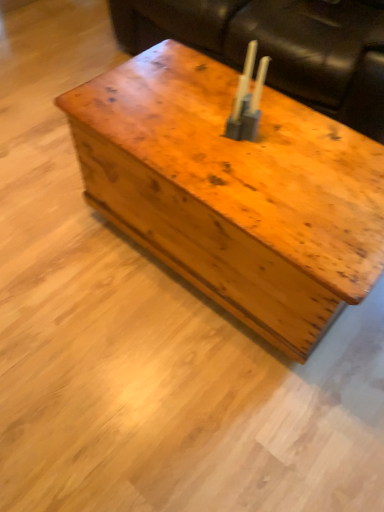
Question: Considering the relative sizes of metallic silver candle holder at center and leather couch at upper center in the image provided, is metallic silver candle holder at center shorter than leather couch at upper center?

Choices:
 (A) yes
 (B) no

Answer: (A)

Question: Does metallic silver candle holder at center have a greater height compared to leather couch at upper center?

Choices:
 (A) no
 (B) yes

Answer: (A)

Question: From the image's perspective, is metallic silver candle holder at center above leather couch at upper center?

Choices:
 (A) yes
 (B) no

Answer: (B)

Question: Is metallic silver candle holder at center in front of leather couch at upper center?

Choices:
 (A) yes
 (B) no

Answer: (A)

Question: Does metallic silver candle holder at center appear on the right side of leather couch at upper center?

Choices:
 (A) no
 (B) yes

Answer: (A)

Question: Choose the correct answer: Is wooden trunk at center inside leather couch at upper center or outside it?

Choices:
 (A) inside
 (B) outside

Answer: (B)

Question: Does point (180, 65) appear closer or farther from the camera than point (347, 11)?

Choices:
 (A) farther
 (B) closer

Answer: (B)

Question: From the image's perspective, relative to leather couch at upper center, is wooden trunk at center above or below?

Choices:
 (A) below
 (B) above

Answer: (A)

Question: In terms of height, does wooden trunk at center look taller or shorter compared to leather couch at upper center?

Choices:
 (A) short
 (B) tall

Answer: (A)

Question: Is point (215, 52) positioned closer to the camera than point (296, 270)?

Choices:
 (A) closer
 (B) farther

Answer: (B)

Question: From a real-world perspective, relative to wooden trunk at center, is leather couch at upper center vertically above or below?

Choices:
 (A) below
 (B) above

Answer: (B)

Question: Considering the positions of leather couch at upper center and wooden trunk at center in the image, is leather couch at upper center wider or thinner than wooden trunk at center?

Choices:
 (A) thin
 (B) wide

Answer: (B)

Question: In terms of size, does leather couch at upper center appear bigger or smaller than wooden trunk at center?

Choices:
 (A) big
 (B) small

Answer: (A)

Question: From the image's perspective, relative to wooden trunk at center, is metallic silver candle holder at center above or below?

Choices:
 (A) above
 (B) below

Answer: (A)

Question: Based on their positions, is metallic silver candle holder at center located to the left or right of wooden trunk at center?

Choices:
 (A) right
 (B) left

Answer: (A)